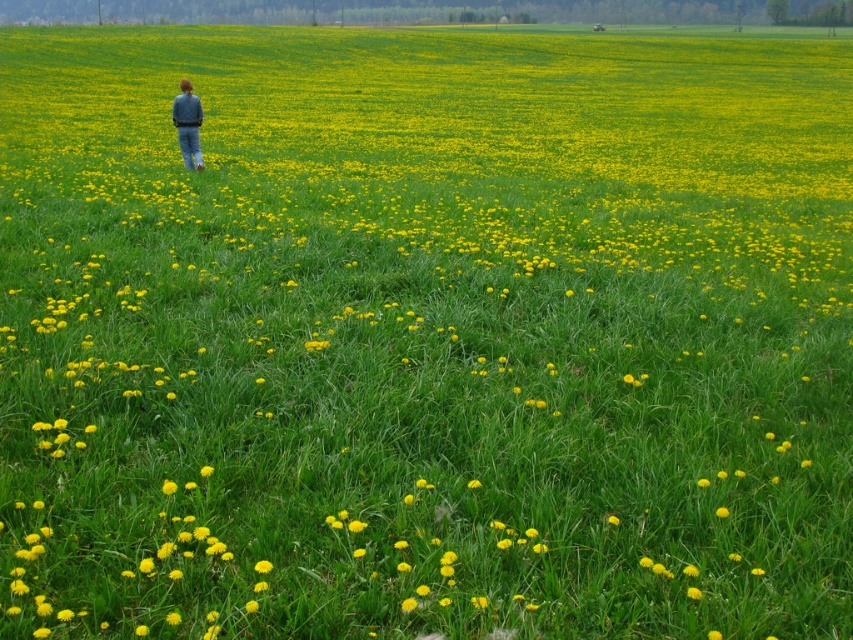
Question: Does denim jacket at upper left appear on the left side of yellow matte flower at center?

Choices:
 (A) no
 (B) yes

Answer: (B)

Question: Among these points, which one is nearest to the camera?

Choices:
 (A) (190, 154)
 (B) (253, 564)

Answer: (B)

Question: Can you confirm if denim jacket at upper left is positioned to the left of yellow matte flower at center?

Choices:
 (A) no
 (B) yes

Answer: (B)

Question: Which object appears farthest from the camera in this image?

Choices:
 (A) yellow matte flower at center
 (B) denim jacket at upper left

Answer: (B)

Question: Which point is closer to the camera taking this photo?

Choices:
 (A) (263, 566)
 (B) (200, 163)

Answer: (A)

Question: Is denim jacket at upper left below yellow matte flower at center?

Choices:
 (A) no
 (B) yes

Answer: (A)